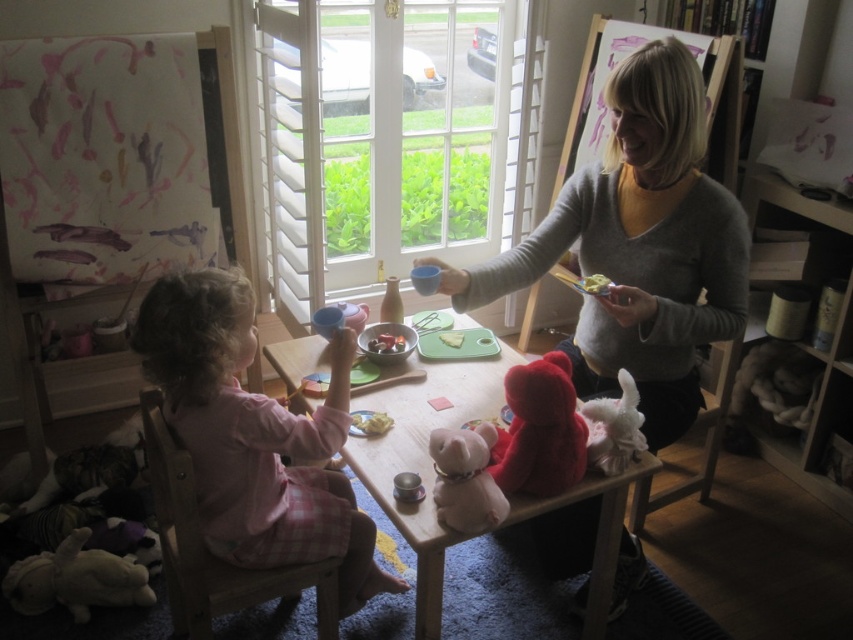
Is velvet plush bear at center shorter than white plush dog at center?

No, velvet plush bear at center is not shorter than white plush dog at center.

At what (x,y) coordinates should I click in order to perform the action: click on velvet plush bear at center. Please return your answer as a coordinate pair (x, y). The width and height of the screenshot is (853, 640). Looking at the image, I should click on (538, 429).

Is point (33, 577) closer to camera compared to point (593, 426)?

No, (33, 577) is further to viewer.

Can you confirm if fluffy white stuffed animal at lower left is positioned to the right of fluffy white stuffed animal at lower center?

Incorrect, fluffy white stuffed animal at lower left is not on the right side of fluffy white stuffed animal at lower center.

Measure the distance between point (85, 552) and camera.

Point (85, 552) and camera are 2.14 meters apart.

Identify the location of fluffy white stuffed animal at lower left. (74, 579).

Can you confirm if velvet plush bear at center is positioned below fluffy white stuffed animal at lower center?

Incorrect, velvet plush bear at center is not positioned below fluffy white stuffed animal at lower center.

How much distance is there between velvet plush bear at center and fluffy white stuffed animal at lower center?

A distance of 4.76 inches exists between velvet plush bear at center and fluffy white stuffed animal at lower center.

This screenshot has width=853, height=640. I want to click on velvet plush bear at center, so click(538, 429).